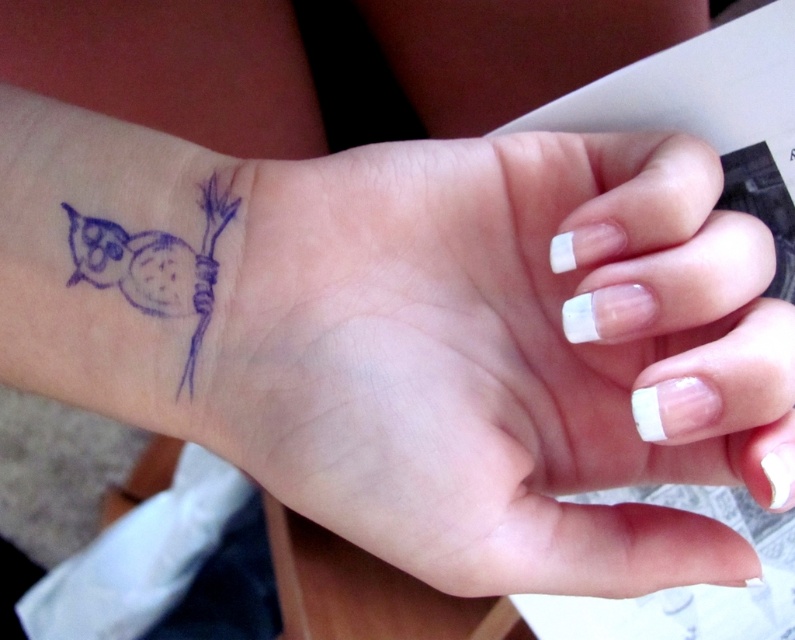
You are a tattoo artist assessing the spacing between two tattoos on a client. The client has a matte blue tattoo at upper left and a blue ink owl at lower left. Given that the minimum recommended distance between tattoos for healing is 3 inches, can the client safely get another tattoo between them?

The matte blue tattoo at upper left and blue ink owl at lower left are 4.73 inches apart. Since the minimum recommended distance for healing is 3 inches, the client can safely get another tattoo between them as the existing spacing exceeds the required distance.

You are a tattoo artist reviewing a client photo. The client wants to add a new tattoo between the matte blue tattoo at upper left and the blue ink owl at lower left on their wrist. Based on their current placement, where should the new tattoo be positioned?

The new tattoo should be placed above the blue ink owl at lower left because the matte blue tattoo at upper left is located below it, meaning the owl is higher up on the wrist.

You are a tattoo artist reviewing a client design. The client wants to place a new tattoo between the matte blue tattoo at upper left and the blue ink owl at lower left on their wrist. Based on the current spacing, can you estimate if there is enough room for a new tattoo that is 1.5 inches wide?

The matte blue tattoo at upper left might be wider than blue ink owl at lower left. Since the exact width of both tattoos isn t provided, it s difficult to determine if there s enough space for a 1.5 inch wide tattoo between them. More information about their dimensions would be needed to make an accurate assessment.